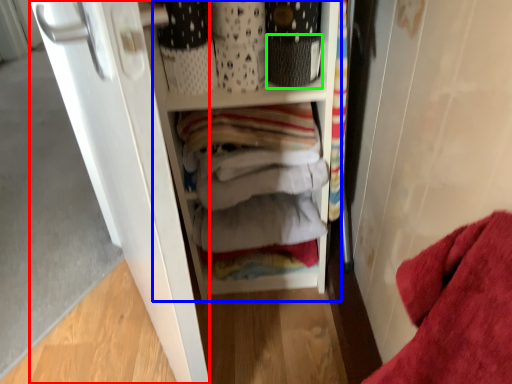
Question: Which object is positioned farthest from door (highlighted by a red box)? Select from cabinetry (highlighted by a blue box) and basket (highlighted by a green box).

Choices:
 (A) cabinetry
 (B) basket

Answer: (B)